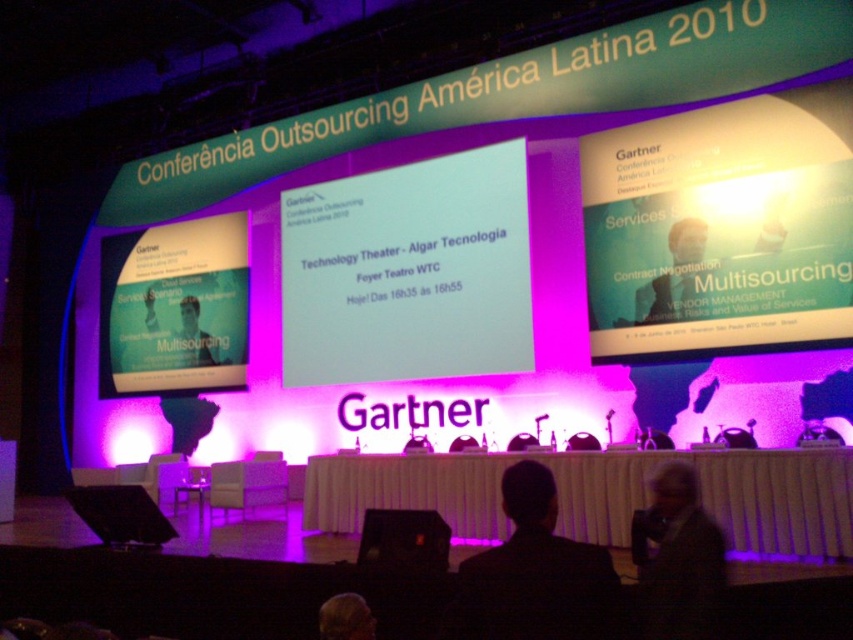
You are standing at the back of the conference hall and want to read the matte white text at center displayed on the presentation screen. The average reading distance for text is 2.5 meters. Can you comfortably read the text from your current position?

The matte white text at center is 12.92 meters away from the viewer. Since the average reading distance is 2.5 meters, the text cannot be comfortably read from 12.92 meters away.

You are standing in the conference room and see the point marked at coordinate (676, 276). What object is located at that position?

The point at coordinate (676, 276) indicates a smooth plastic person at center.

You are a photographer positioned at the camera location. You need to capture a clear image of the white glossy projector screen at center. Considering the distance, what is the minimum focal length required for your camera lens to focus on the screen without blurring?

The minimum focal length required is determined by the distance between the camera and the white glossy projector screen at center, which is 12.75 meters. However, without additional information about the sensor size or acceptable depth of field, a precise calculation cannot be provided. Generally, a longer focal length would help in magnifying the screen while maintaining focus at that distance.